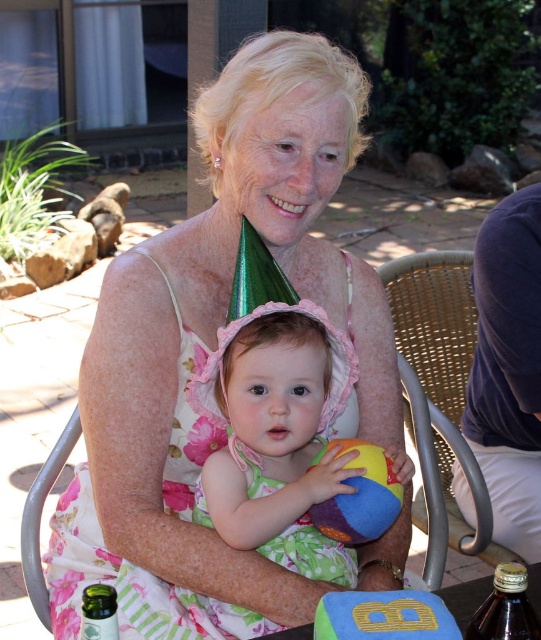
You are taking a photo of two points in the scene. The first point is at position point (353, 275) and the second point is at position point (473, 339). Which point will appear larger in your photo?

Point (353, 275) is closer to the camera than point (473, 339), so it will appear larger in the photo.

You are a photographer positioned at the origin point in the scene. You need to take a photo of the green rubber block at center. What are the coordinates where you should aim your camera?

The coordinates to aim the camera are at point (384, 616) as stated in the description.

You are organizing a childrens party and need to choose between the green rubber block at center and the multicolored fabric beach ball at center for a game. Which object takes up more space?

The multicolored fabric beach ball at center takes up more space than the green rubber block at center because the green rubber block at center occupies less space than multicolored fabric beach ball at center.